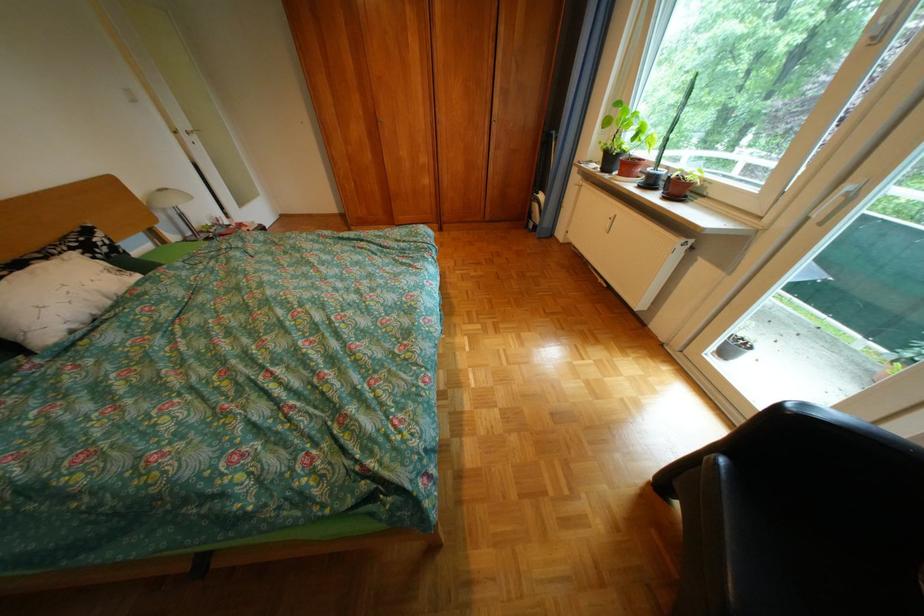
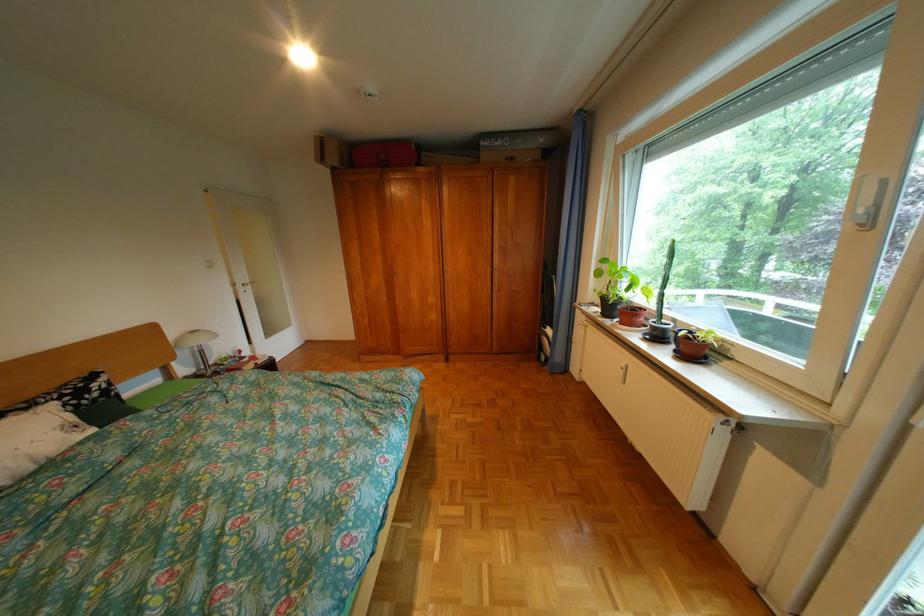
Where in the second image is the point corresponding to pixel 696 251 from the first image?

(738, 432)